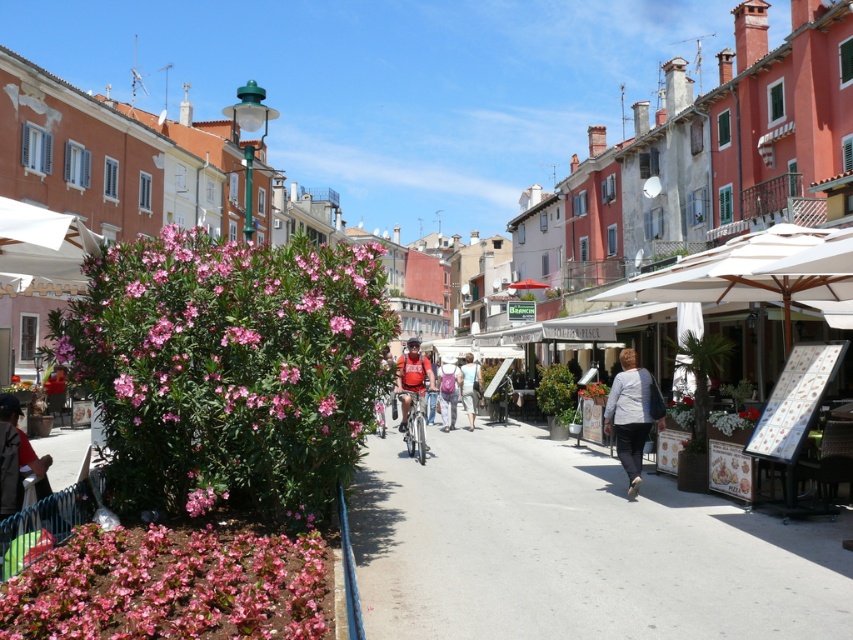
Which is below, white fabric canopy at upper left or matte red backpack at center?

Positioned lower is matte red backpack at center.

Is white fabric canopy at upper left smaller than matte red backpack at center?

No, white fabric canopy at upper left is not smaller than matte red backpack at center.

Is point (20, 256) behind point (474, 372)?

No, it is in front of (474, 372).

Locate an element on the screen. white fabric canopy at upper left is located at coordinates (41, 246).

Between pink matte flowers at lower left and matte red backpack at center, which one is positioned lower?

Positioned lower is pink matte flowers at lower left.

This screenshot has height=640, width=853. Identify the location of pink matte flowers at lower left. (169, 586).

This screenshot has height=640, width=853. In order to click on pink matte flowers at lower left in this screenshot , I will do `click(169, 586)`.

Between matte red shirt at center and pink matte flower at center, which one has less height?

Standing shorter between the two is pink matte flower at center.

Who is lower down, matte red shirt at center or pink matte flower at center?

matte red shirt at center is below.

Which is in front, point (401, 388) or point (589, 381)?

Point (401, 388)

Locate an element on the screen. matte red shirt at center is located at coordinates (412, 378).